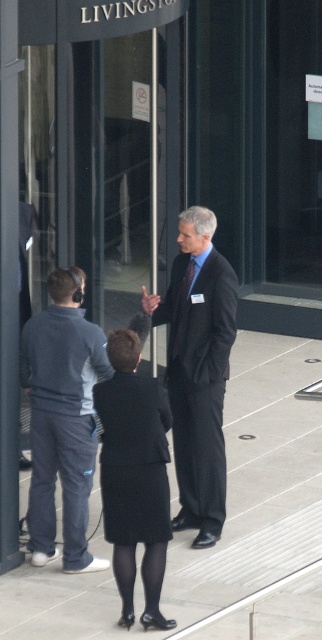
You are a security guard at the Livingston building. You need to determine which of the two items, the dark gray fleece jacket at left or the black fabric skirt at center, is bigger in size. Based on the scene description, which one is larger?

The dark gray fleece jacket at left is larger in size compared to the black fabric skirt at center.

You are a security guard at the Livingston building. You notice two people near the revolving door. One is wearing a dark suit at center and another in a dark gray fleece jacket at left. Which person is closer to the revolving door?

The dark suit at center is closer to the revolving door because it is positioned over the dark gray fleece jacket at left, indicating it is in front.

You are an event planner organizing a meeting at the Livingston building. You need to seat two attendees based on their clothing descriptions. The dark suit at center and the black fabric skirt at center are in the same area. Which attendee should you seat in a larger chair to accommodate their clothing size?

The dark suit at center is larger in size than the black fabric skirt at center, so you should seat the attendee in the dark suit at center in a larger chair to accommodate their clothing size.